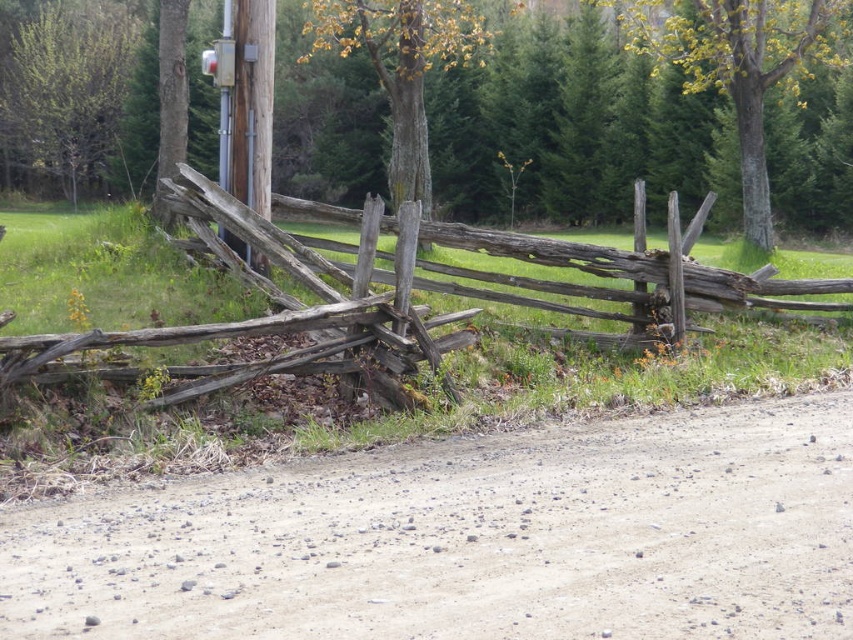
Question: Which object appears farthest from the camera in this image?

Choices:
 (A) smooth wooden post at center
 (B) smooth brown wood at upper right
 (C) metallic gray pole at upper center
 (D) smooth brown tree trunk at upper center

Answer: (D)

Question: Which of the following is the farthest from the observer?

Choices:
 (A) metallic gray pole at upper center
 (B) smooth brown tree trunk at upper center
 (C) smooth brown wood at upper right
 (D) smooth wooden post at center

Answer: (B)

Question: Can you confirm if brown rough wood tree at center is thinner than smooth wooden post at center?

Choices:
 (A) no
 (B) yes

Answer: (A)

Question: Which point is farther to the camera?

Choices:
 (A) (711, 33)
 (B) (427, 140)
 (C) (258, 211)
 (D) (225, 3)

Answer: (B)

Question: Is brown gravelly dirt track at lower center below smooth wooden post at center?

Choices:
 (A) yes
 (B) no

Answer: (A)

Question: Is brown gravelly dirt track at lower center smaller than smooth wooden post at center?

Choices:
 (A) no
 (B) yes

Answer: (B)